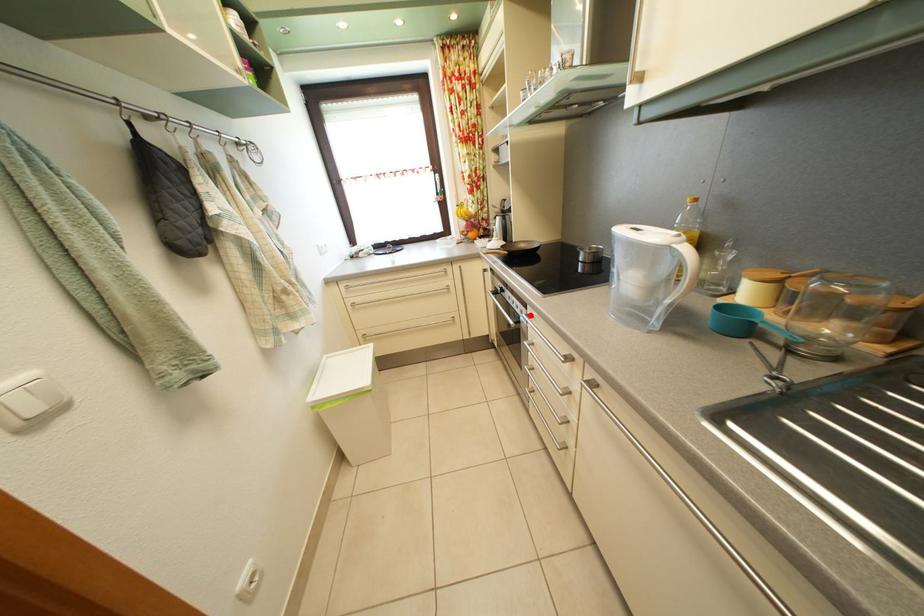
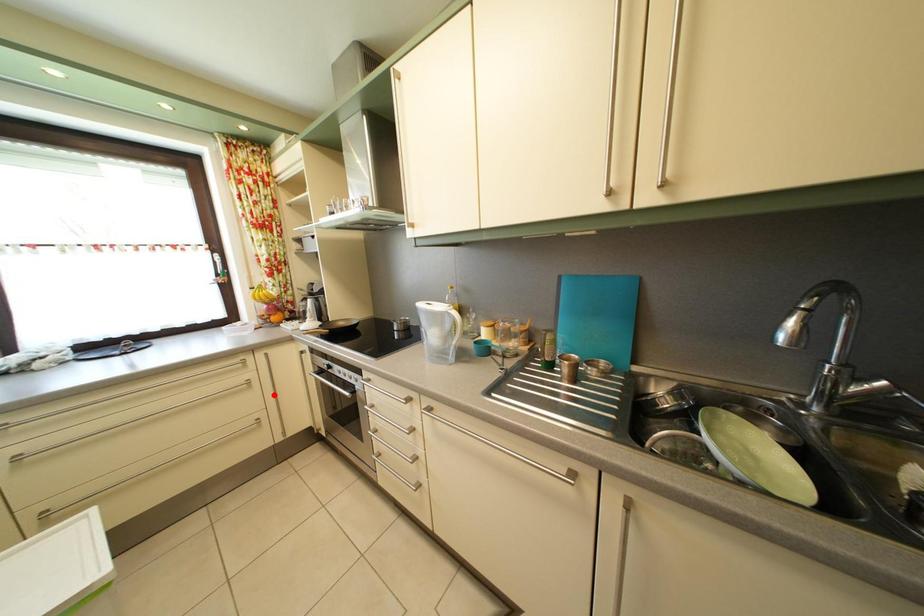
I am providing you with two images of the same scene from different viewpoints. A red point is marked on the first image and another point is marked on the second image. Do the highlighted points in image1 and image2 indicate the same real-world spot?

No